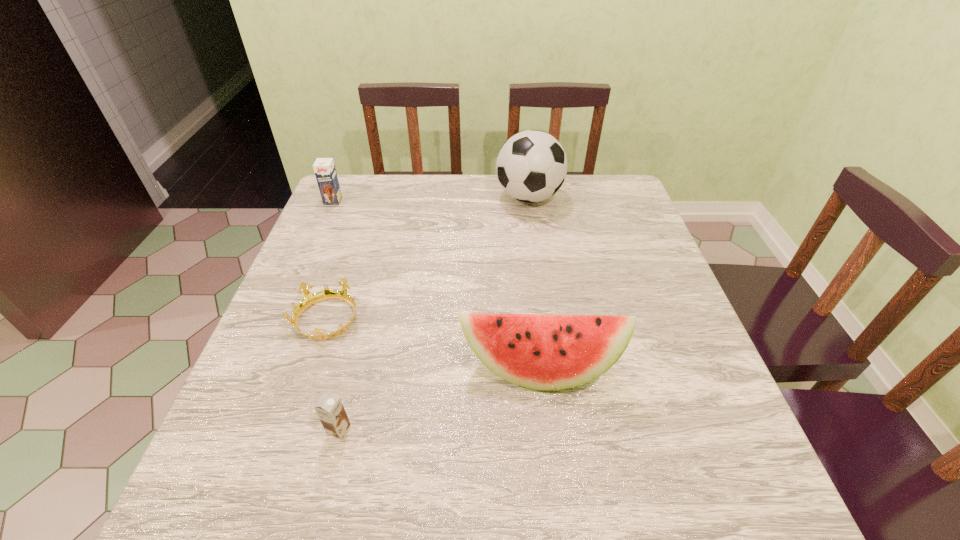
Where is `blank space at the right edge of the desktop`? The width and height of the screenshot is (960, 540). blank space at the right edge of the desktop is located at coordinates (646, 341).

Find the location of a particular element. free region at the near right corner is located at coordinates (706, 475).

Where is `vacant region between the fourth shortest object and the shortest object`? vacant region between the fourth shortest object and the shortest object is located at coordinates (433, 344).

Where is `unoccupied position between the nearer chocolate milk and the left chocolate milk`? The width and height of the screenshot is (960, 540). unoccupied position between the nearer chocolate milk and the left chocolate milk is located at coordinates (336, 315).

Where is `free space between the left chocolate milk and the watermelon`? Image resolution: width=960 pixels, height=540 pixels. free space between the left chocolate milk and the watermelon is located at coordinates (436, 285).

I want to click on vacant space that's between the tallest object and the second tallest object, so click(534, 283).

Locate an element on the screen. Image resolution: width=960 pixels, height=540 pixels. free space between the crown and the leftmost object is located at coordinates (330, 260).

Locate an element on the screen. The width and height of the screenshot is (960, 540). free spot between the crown and the right chocolate milk is located at coordinates (333, 375).

You are a GUI agent. You are given a task and a screenshot of the screen. Output one action in this format:
    pyautogui.click(x=<x>, y=<y>)
    Task: Click on the unoccupied area between the watermelon and the shortest object
    The image size is (960, 540).
    Given the screenshot: What is the action you would take?
    pyautogui.click(x=433, y=344)

What are the coordinates of `vacant space that is in between the watermelon and the right chocolate milk` in the screenshot? It's located at (439, 399).